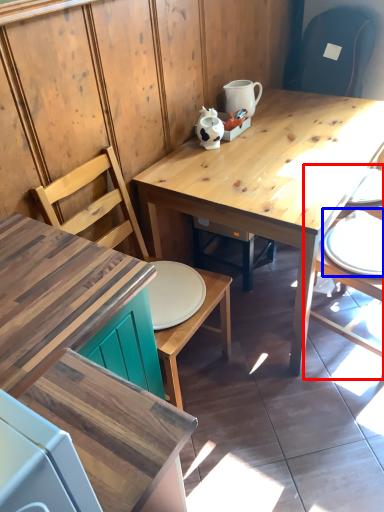
Question: Which object appears closest to the camera in this image, chair (highlighted by a red box) or tableware (highlighted by a blue box)?

Choices:
 (A) chair
 (B) tableware

Answer: (A)